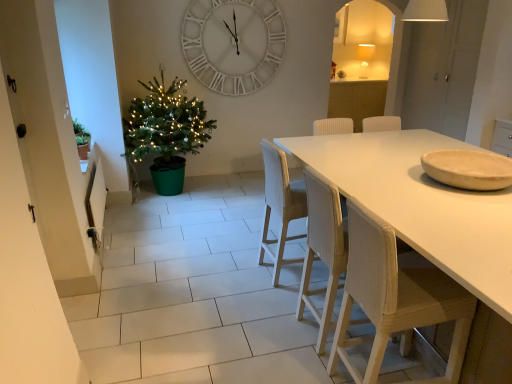
Question: Does green matte christmas tree at left have a greater width compared to green matte plant at left?

Choices:
 (A) yes
 (B) no

Answer: (A)

Question: From a real-world perspective, is green matte christmas tree at left physically below green matte plant at left?

Choices:
 (A) yes
 (B) no

Answer: (A)

Question: From the image's perspective, is green matte christmas tree at left beneath green matte plant at left?

Choices:
 (A) yes
 (B) no

Answer: (B)

Question: From a real-world perspective, does green matte christmas tree at left stand above green matte plant at left?

Choices:
 (A) no
 (B) yes

Answer: (A)

Question: Are green matte christmas tree at left and green matte plant at left making contact?

Choices:
 (A) no
 (B) yes

Answer: (A)

Question: Is wooden textured chair at right, the first chair from the front, wider or thinner than wooden bowl at right?

Choices:
 (A) thin
 (B) wide

Answer: (A)

Question: In terms of size, does wooden textured chair at right, the first chair from the front, appear bigger or smaller than wooden bowl at right?

Choices:
 (A) small
 (B) big

Answer: (B)

Question: Is wooden textured chair at right, acting as the 3th chair starting from the back, situated inside wooden bowl at right or outside?

Choices:
 (A) inside
 (B) outside

Answer: (B)

Question: In the image, is wooden textured chair at right, the first chair from the front, positioned in front of or behind wooden bowl at right?

Choices:
 (A) behind
 (B) front

Answer: (B)

Question: Based on their positions, is green matte christmas tree at left located to the left or right of woven wood chair at center, the 1th chair in the back-to-front sequence?

Choices:
 (A) left
 (B) right

Answer: (A)

Question: Does point (172, 150) appear closer or farther from the camera than point (274, 168)?

Choices:
 (A) farther
 (B) closer

Answer: (A)

Question: From the image's perspective, is green matte christmas tree at left above or below woven wood chair at center, the 1th chair in the back-to-front sequence?

Choices:
 (A) above
 (B) below

Answer: (A)

Question: In the image, is green matte christmas tree at left positioned in front of or behind woven wood chair at center, the 1th chair in the back-to-front sequence?

Choices:
 (A) behind
 (B) front

Answer: (A)

Question: Relative to green matte plant at left, is white woven chair at center, arranged as the 2th chair when viewed from the back, in front or behind?

Choices:
 (A) front
 (B) behind

Answer: (A)

Question: Considering the positions of white woven chair at center, which is the second chair in front-to-back order, and green matte plant at left in the image, is white woven chair at center, which is the second chair in front-to-back order, wider or thinner than green matte plant at left?

Choices:
 (A) wide
 (B) thin

Answer: (A)